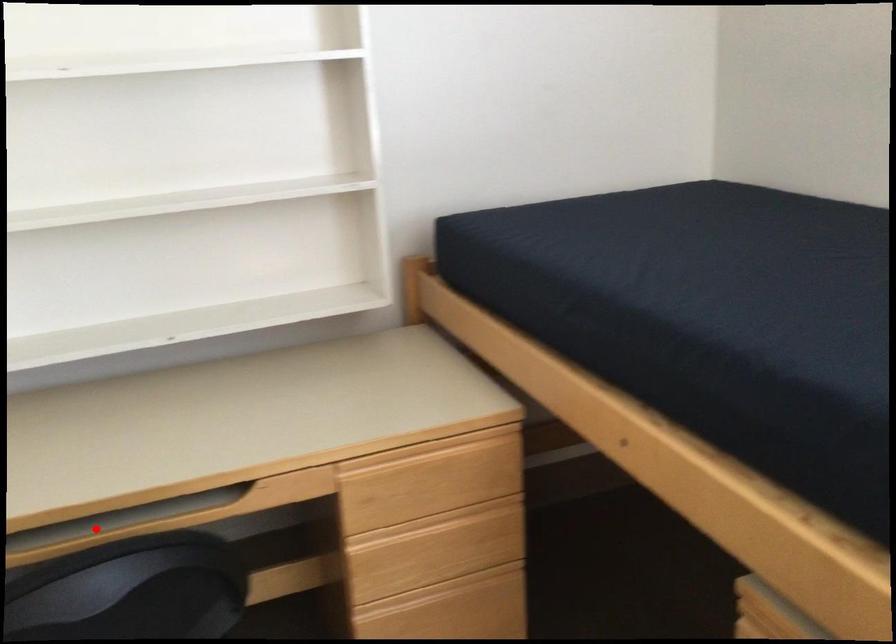
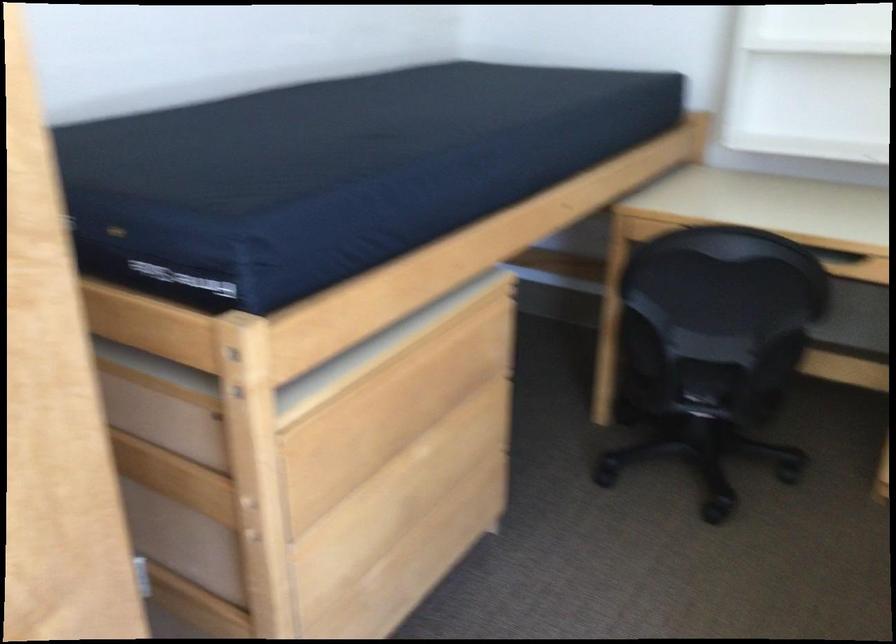
Question: I am providing you with two images of the same scene from different viewpoints. A red point is marked on the first image. Is the red point's position out of view in image 2?

Choices:
 (A) Yes
 (B) No

Answer: (A)